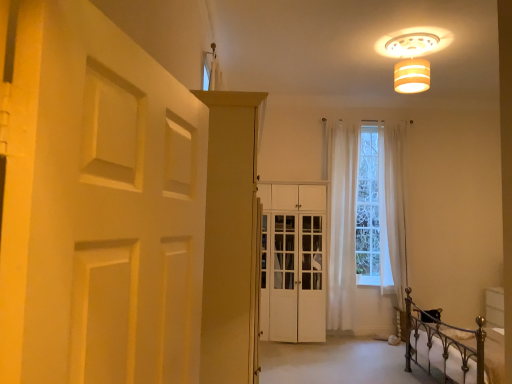
Question: Does white matte door at left have a smaller size compared to white wood cabinet at center, the 2th door positioned from the left?

Choices:
 (A) no
 (B) yes

Answer: (B)

Question: Is white wood cabinet at center, which is the 2th door from front to back, located within white matte door at left?

Choices:
 (A) yes
 (B) no

Answer: (B)

Question: Is white matte door at left at the right side of white wood cabinet at center, which is the 2th door from front to back?

Choices:
 (A) no
 (B) yes

Answer: (A)

Question: Is white matte door at left oriented towards white wood cabinet at center, positioned as the first door in right-to-left order?

Choices:
 (A) yes
 (B) no

Answer: (B)

Question: Is white matte door at left oriented away from white wood cabinet at center, which is the 2th door from front to back?

Choices:
 (A) yes
 (B) no

Answer: (B)

Question: Can we say white matte door at left lies outside white wood cabinet at center, the 2th door positioned from the left?

Choices:
 (A) yes
 (B) no

Answer: (A)

Question: From a real-world perspective, is white sheer curtain at center, marked as the second curtain in a right-to-left arrangement, positioned under white sheer curtain at center, the 1th curtain when ordered from right to left, based on gravity?

Choices:
 (A) yes
 (B) no

Answer: (A)

Question: Does white sheer curtain at center, marked as the second curtain in a right-to-left arrangement, lie behind white sheer curtain at center, arranged as the 2th curtain when viewed from the left?

Choices:
 (A) no
 (B) yes

Answer: (A)

Question: Considering the relative sizes of white sheer curtain at center, the 1th curtain in the left-to-right sequence, and white sheer curtain at center, arranged as the 2th curtain when viewed from the left, in the image provided, is white sheer curtain at center, the 1th curtain in the left-to-right sequence, shorter than white sheer curtain at center, arranged as the 2th curtain when viewed from the left,?

Choices:
 (A) no
 (B) yes

Answer: (A)

Question: Is white sheer curtain at center, marked as the second curtain in a right-to-left arrangement, placed right next to white sheer curtain at center, the 1th curtain when ordered from right to left?

Choices:
 (A) no
 (B) yes

Answer: (A)

Question: Can you confirm if white sheer curtain at center, marked as the second curtain in a right-to-left arrangement, is smaller than white sheer curtain at center, the 1th curtain when ordered from right to left?

Choices:
 (A) yes
 (B) no

Answer: (A)

Question: Considering the relative positions of white sheer curtain at center, the 1th curtain in the left-to-right sequence, and white sheer curtain at center, the 1th curtain when ordered from right to left, in the image provided, is white sheer curtain at center, the 1th curtain in the left-to-right sequence, to the left of white sheer curtain at center, the 1th curtain when ordered from right to left, from the viewer's perspective?

Choices:
 (A) no
 (B) yes

Answer: (B)

Question: From a real-world perspective, is matte white cabinet at center, the second door in the back-to-front sequence, under white sheer curtain at center, the 1th curtain when ordered from right to left?

Choices:
 (A) yes
 (B) no

Answer: (A)